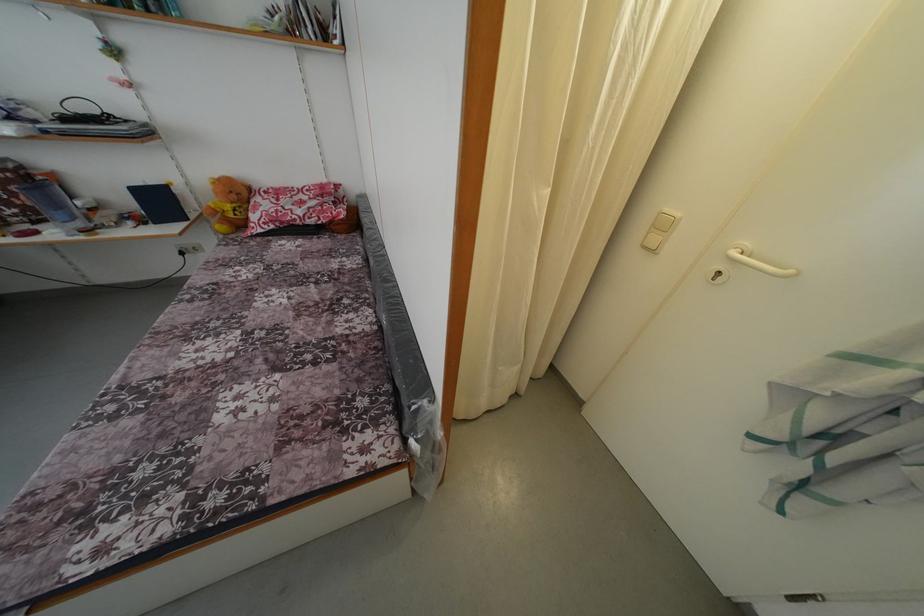
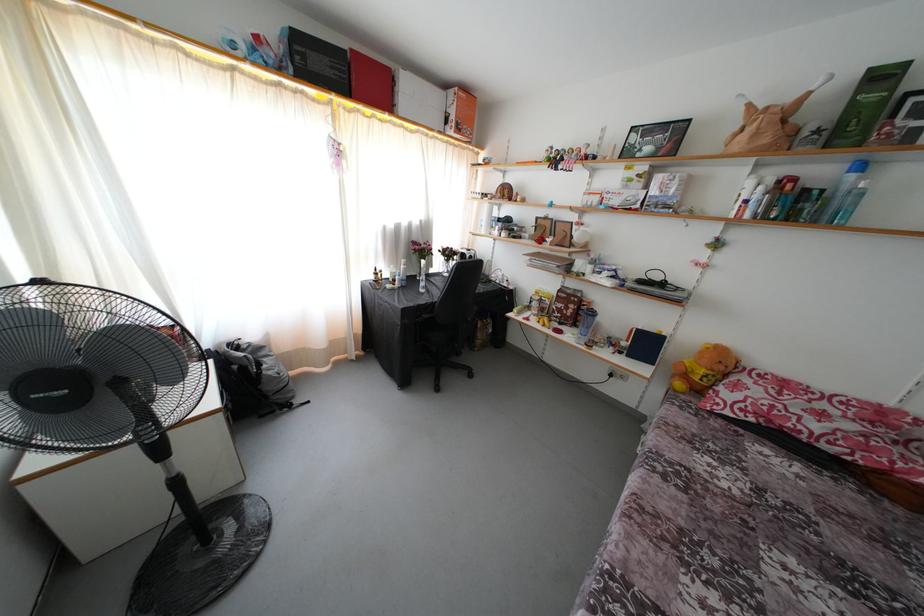
Question: How did the camera likely rotate?

Choices:
 (A) Left
 (B) Right
 (C) Up
 (D) Down

Answer: (A)